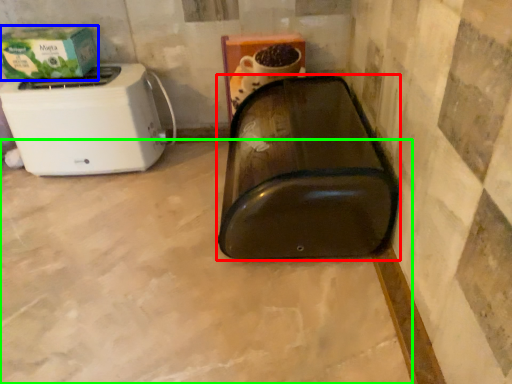
Question: Which object is the closest to the appliance (highlighted by a red box)? Choose among these: box (highlighted by a blue box) or concrete (highlighted by a green box).

Choices:
 (A) box
 (B) concrete

Answer: (B)